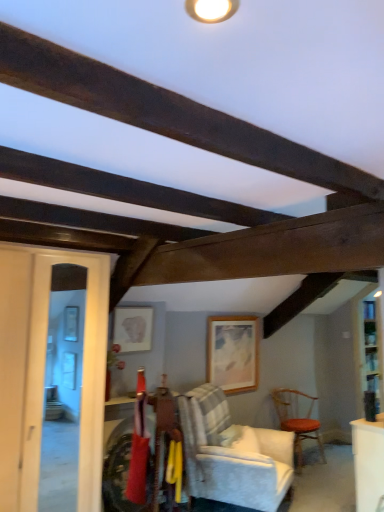
Question: Is white upholstered chair at center, which ranks as the 2th chair in back-to-front order, oriented towards wooden at center, the first picture frame viewed from the right?

Choices:
 (A) yes
 (B) no

Answer: (B)

Question: Are white upholstered chair at center, which appears as the second chair when viewed from the right, and wooden at center, which is counted as the first picture frame, starting from the back, far apart?

Choices:
 (A) yes
 (B) no

Answer: (B)

Question: From the image's perspective, is white upholstered chair at center, placed as the 1th chair when sorted from left to right, located beneath wooden at center, the first picture frame viewed from the right?

Choices:
 (A) yes
 (B) no

Answer: (A)

Question: Can you confirm if white upholstered chair at center, which appears as the second chair when viewed from the right, is wider than wooden at center, which is counted as the second picture frame, starting from the front?

Choices:
 (A) no
 (B) yes

Answer: (B)

Question: Can you confirm if white upholstered chair at center, which appears as the second chair when viewed from the right, is positioned to the right of wooden at center, the 2th picture frame from the left?

Choices:
 (A) no
 (B) yes

Answer: (A)

Question: Is matte red fabric at center in front of or behind white upholstered chair at center, marked as the first chair in a front-to-back arrangement, in the image?

Choices:
 (A) front
 (B) behind

Answer: (A)

Question: From a real-world perspective, relative to white upholstered chair at center, marked as the first chair in a front-to-back arrangement, is matte red fabric at center vertically above or below?

Choices:
 (A) above
 (B) below

Answer: (A)

Question: From their relative heights in the image, would you say matte red fabric at center is taller or shorter than white upholstered chair at center, placed as the 1th chair when sorted from left to right?

Choices:
 (A) tall
 (B) short

Answer: (B)

Question: In the image, is matte red fabric at center on the left side or the right side of white upholstered chair at center, which appears as the second chair when viewed from the right?

Choices:
 (A) left
 (B) right

Answer: (A)

Question: In terms of width, does wooden at center, which is counted as the first picture frame, starting from the back, look wider or thinner when compared to dark wood beam at upper center?

Choices:
 (A) wide
 (B) thin

Answer: (A)

Question: Would you say wooden at center, the first picture frame viewed from the right, is to the left or to the right of dark wood beam at upper center in the picture?

Choices:
 (A) left
 (B) right

Answer: (B)

Question: From their relative heights in the image, would you say wooden at center, which is counted as the first picture frame, starting from the back, is taller or shorter than dark wood beam at upper center?

Choices:
 (A) short
 (B) tall

Answer: (B)

Question: Looking at the image, does wooden at center, which is counted as the first picture frame, starting from the back, seem bigger or smaller compared to dark wood beam at upper center?

Choices:
 (A) big
 (B) small

Answer: (A)

Question: From the image's perspective, relative to wooden textured chair at right, the first chair positioned from the right, is matte red fabric at center above or below?

Choices:
 (A) above
 (B) below

Answer: (A)

Question: In the image, is matte red fabric at center on the left side or the right side of wooden textured chair at right, the 2th chair viewed from the left?

Choices:
 (A) right
 (B) left

Answer: (B)